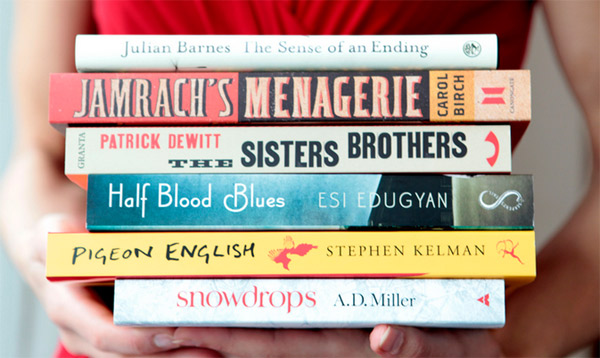
Image resolution: width=600 pixels, height=358 pixels. In order to click on book in this screenshot , I will do `click(221, 53)`, `click(244, 83)`, `click(266, 154)`, `click(274, 205)`, `click(271, 252)`, `click(273, 302)`.